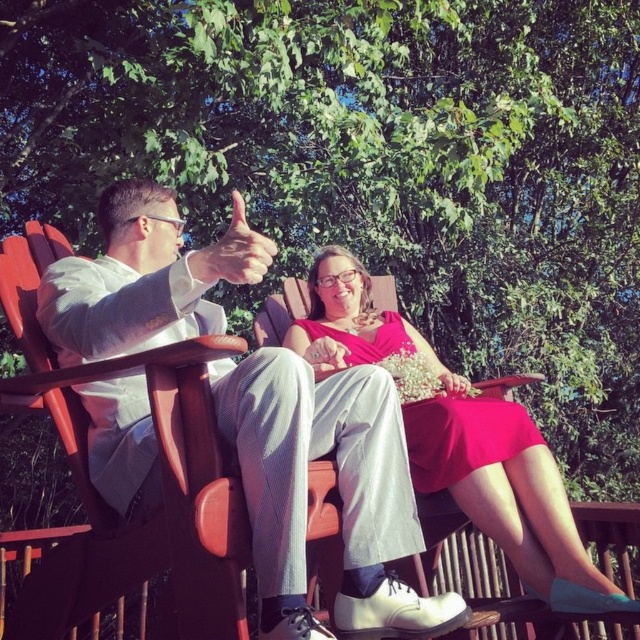
Does light gray suit at center appear on the left side of matte pink dress at center?

Indeed, light gray suit at center is positioned on the left side of matte pink dress at center.

Is light gray suit at center wider than matte pink dress at center?

Yes, light gray suit at center is wider than matte pink dress at center.

Is point (168, 275) positioned behind point (339, 260)?

No, (168, 275) is in front of (339, 260).

At what (x,y) coordinates should I click in order to perform the action: click on light gray suit at center. Please return your answer as a coordinate pair (x, y). The width and height of the screenshot is (640, 640). Looking at the image, I should click on (339, 492).